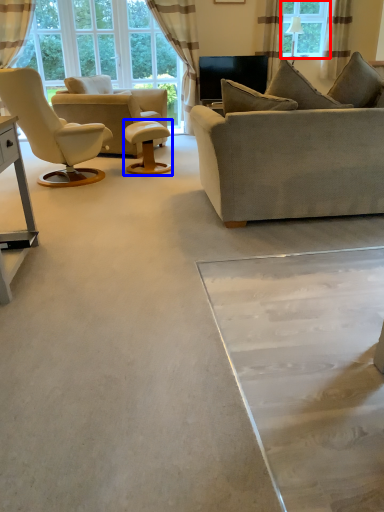
Question: Which object appears farthest to the camera in this image, window (highlighted by a red box) or round table (highlighted by a blue box)?

Choices:
 (A) window
 (B) round table

Answer: (A)